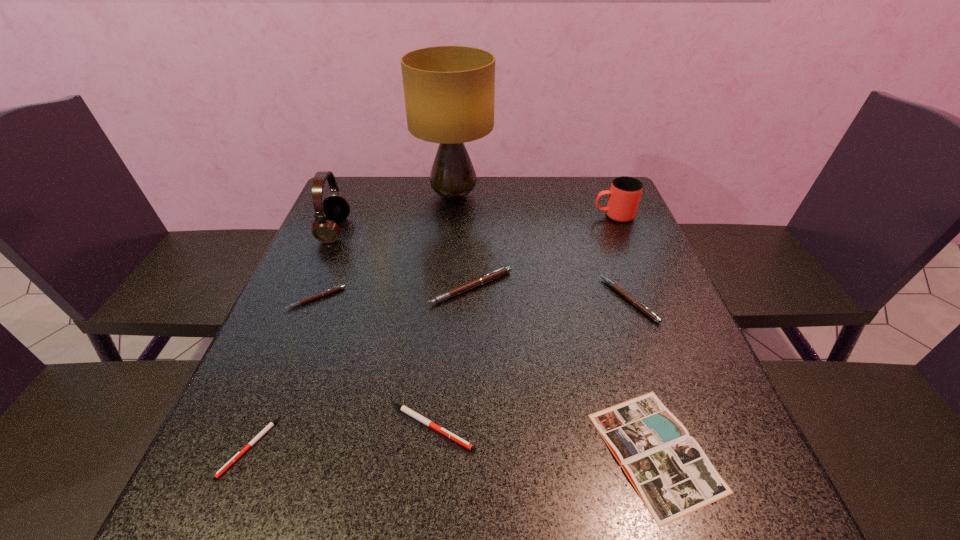
This screenshot has width=960, height=540. What are the coordinates of `vacant area that lies between the headset and the left white pen` in the screenshot? It's located at (292, 339).

Where is `vacant area that lies between the second pink pen from right to left and the fourth shortest pen`? vacant area that lies between the second pink pen from right to left and the fourth shortest pen is located at coordinates pyautogui.click(x=550, y=294).

This screenshot has height=540, width=960. Identify the location of vacant area that lies between the rightmost pen and the eighth shortest object. [482, 265].

Locate an element on the screen. This screenshot has height=540, width=960. vacant area that lies between the third tallest object and the headset is located at coordinates point(474,223).

The height and width of the screenshot is (540, 960). What are the coordinates of `empty space that is in between the smaller white pen and the lampshade` in the screenshot? It's located at (351, 322).

Identify the location of free point between the biggest pink pen and the book. The image size is (960, 540). (564, 369).

Identify which object is located as the second nearest to the cup. Please provide its 2D coordinates. Your answer should be formatted as a tuple, i.e. [(x, y)], where the tuple contains the x and y coordinates of a point satisfying the conditions above.

[(449, 91)]

In order to click on object that is the fifth closest one to the sixth shortest object in this screenshot , I will do `click(671, 473)`.

Locate an element on the screen. This screenshot has height=540, width=960. pen identified as the fourth closest to the cup is located at coordinates (340, 287).

The image size is (960, 540). In order to click on pen that can be found as the fourth closest to the book in this screenshot , I will do `click(271, 424)`.